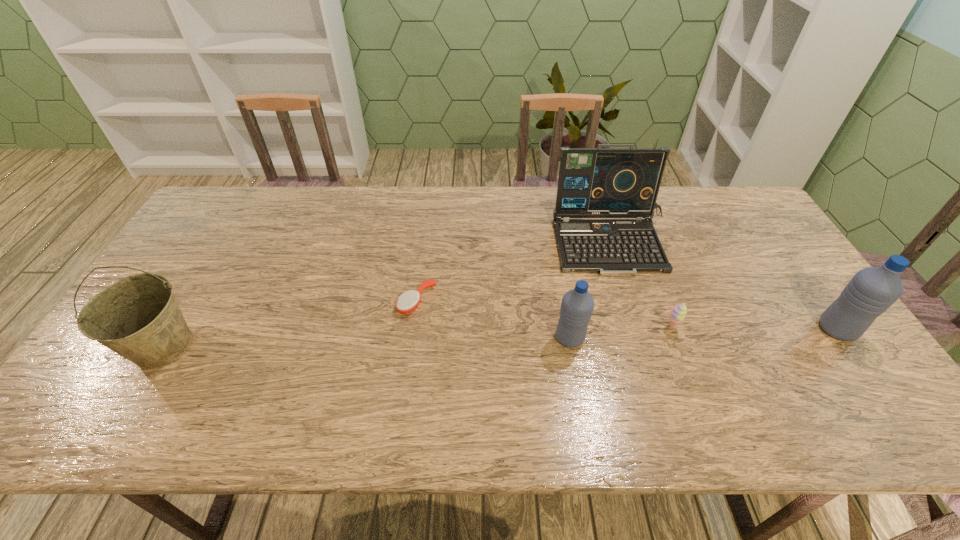
In the image, there is a desktop. Identify the location of vacant space at the far edge. The height and width of the screenshot is (540, 960). (372, 204).

You are a GUI agent. You are given a task and a screenshot of the screen. Output one action in this format:
    pyautogui.click(x=<x>, y=<y>)
    Task: Click on the free space at the near edge of the desktop
    This screenshot has width=960, height=540.
    Given the screenshot: What is the action you would take?
    pyautogui.click(x=712, y=367)

Locate an element on the screen. The image size is (960, 540). free space at the right edge of the desktop is located at coordinates (790, 262).

Locate an element on the screen. This screenshot has height=540, width=960. free space at the far left corner of the desktop is located at coordinates (215, 197).

This screenshot has height=540, width=960. In order to click on free spot at the far right corner of the desktop in this screenshot , I will do 742,202.

At what (x,y) coordinates should I click in order to perform the action: click on free space that is in between the sherbert and the shortest object. Please return your answer as a coordinate pair (x, y). The width and height of the screenshot is (960, 540). Looking at the image, I should click on (544, 314).

Where is `free space between the laptop computer and the shortest object`? The image size is (960, 540). free space between the laptop computer and the shortest object is located at coordinates (515, 272).

Find the location of a particular element. free spot between the rightmost object and the leftmost object is located at coordinates point(500,338).

Identify the location of vacant area that lies between the laptop computer and the wine bucket. Image resolution: width=960 pixels, height=540 pixels. (388, 294).

Where is `vacant region between the wine bucket and the hairbrush`? Image resolution: width=960 pixels, height=540 pixels. vacant region between the wine bucket and the hairbrush is located at coordinates (290, 324).